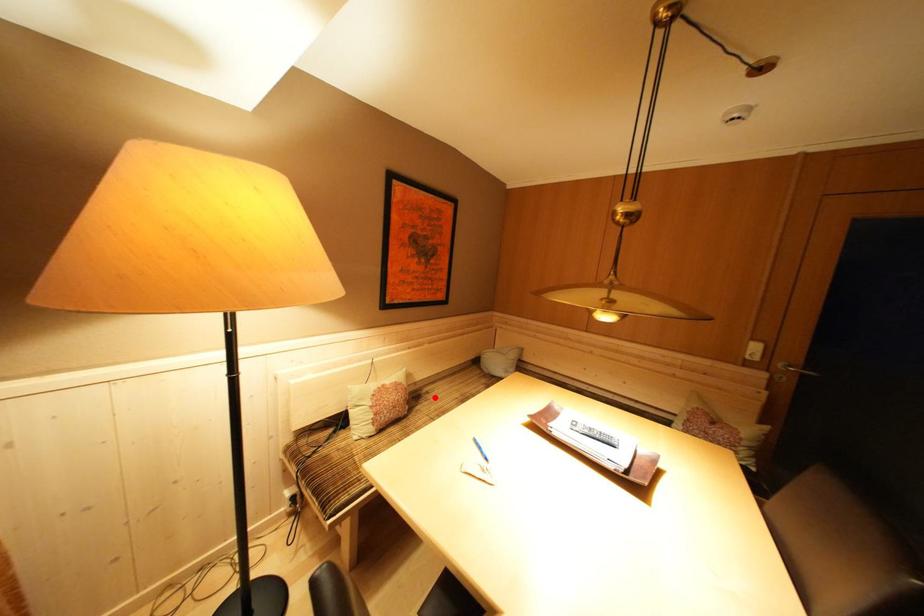
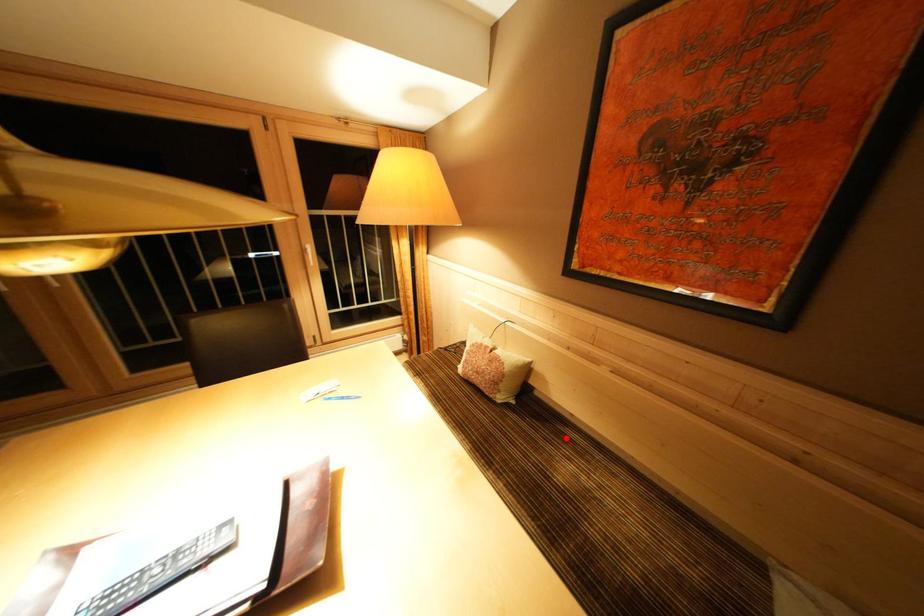
I am providing you with two images of the same scene from different viewpoints. A red point is marked on the first image and another point is marked on the second image. Do the highlighted points in image1 and image2 indicate the same real-world spot?

Yes